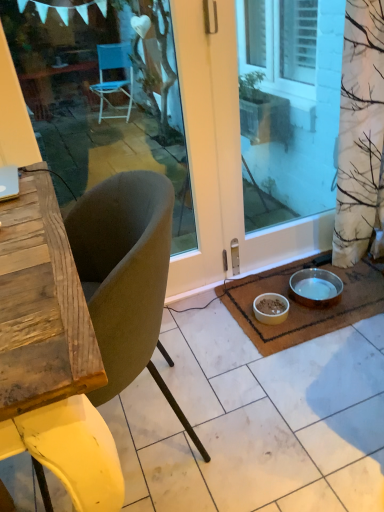
Find the location of `vacant space situated above brown woven mat at lower right (from a real-world perspective)`. vacant space situated above brown woven mat at lower right (from a real-world perspective) is located at coordinates (311, 307).